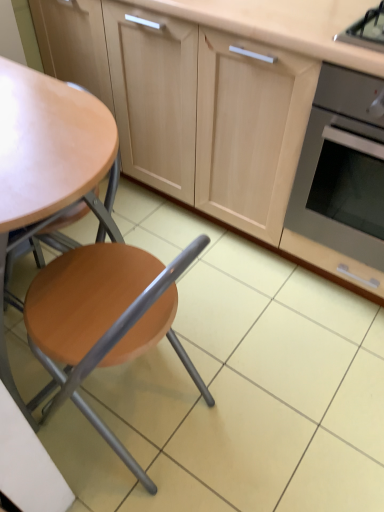
Question: From a real-world perspective, is matte wood cabinetry at center physically below stainless steel oven at right?

Choices:
 (A) no
 (B) yes

Answer: (A)

Question: From the image's perspective, is matte wood cabinetry at center below stainless steel oven at right?

Choices:
 (A) yes
 (B) no

Answer: (B)

Question: Does matte wood cabinetry at center contain stainless steel oven at right?

Choices:
 (A) yes
 (B) no

Answer: (A)

Question: Is matte wood cabinetry at center oriented towards stainless steel oven at right?

Choices:
 (A) yes
 (B) no

Answer: (A)

Question: Is matte wood cabinetry at center placed right next to stainless steel oven at right?

Choices:
 (A) yes
 (B) no

Answer: (B)

Question: Is matte wood cabinetry at center wider or thinner than matte wood chair at left?

Choices:
 (A) thin
 (B) wide

Answer: (B)

Question: From the image's perspective, is matte wood cabinetry at center positioned above or below matte wood chair at left?

Choices:
 (A) below
 (B) above

Answer: (B)

Question: In the image, is matte wood cabinetry at center positioned in front of or behind matte wood chair at left?

Choices:
 (A) front
 (B) behind

Answer: (B)

Question: Is point (221, 218) closer or farther from the camera than point (61, 321)?

Choices:
 (A) closer
 (B) farther

Answer: (B)

Question: Is matte wood cabinetry at center wider or thinner than stainless steel oven at right?

Choices:
 (A) wide
 (B) thin

Answer: (B)

Question: From the image's perspective, is matte wood cabinetry at center above or below stainless steel oven at right?

Choices:
 (A) above
 (B) below

Answer: (A)

Question: Looking at the image, does matte wood cabinetry at center seem bigger or smaller compared to stainless steel oven at right?

Choices:
 (A) small
 (B) big

Answer: (B)

Question: From a real-world perspective, is matte wood cabinetry at center physically located above or below stainless steel oven at right?

Choices:
 (A) below
 (B) above

Answer: (B)

Question: Considering the positions of stainless steel oven at right and matte wood cabinetry at center in the image, is stainless steel oven at right taller or shorter than matte wood cabinetry at center?

Choices:
 (A) tall
 (B) short

Answer: (B)

Question: Is stainless steel oven at right situated inside matte wood cabinetry at center or outside?

Choices:
 (A) inside
 (B) outside

Answer: (A)